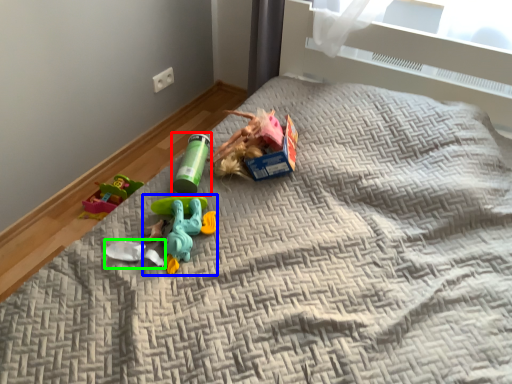
Question: Based on their relative distances, which object is nearer to toy (highlighted by a red box)? Choose from toy (highlighted by a blue box) and toy (highlighted by a green box).

Choices:
 (A) toy
 (B) toy

Answer: (A)